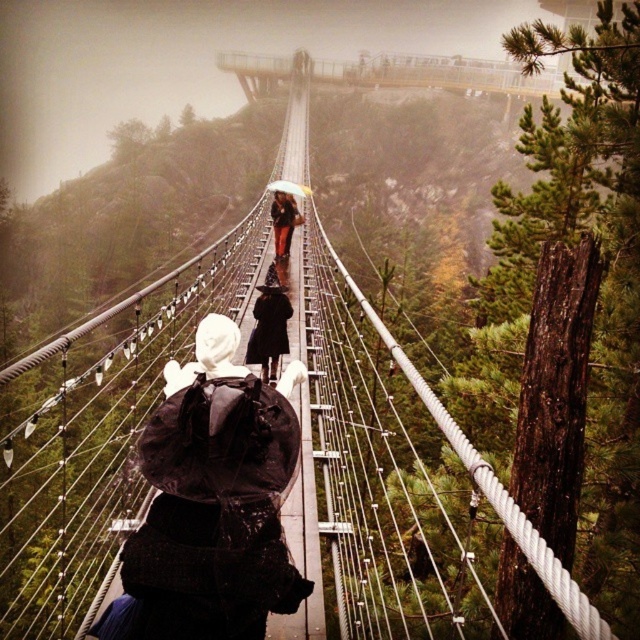
Can you confirm if black matte coat at center is smaller than dark brown leather jacket at center?

Indeed, black matte coat at center has a smaller size compared to dark brown leather jacket at center.

Which is behind, point (257, 362) or point (275, 195)?

The point (275, 195) is behind.

Does point (273, 305) come behind point (285, 205)?

No, it is not.

Image resolution: width=640 pixels, height=640 pixels. What are the coordinates of `black matte coat at center` in the screenshot? It's located at (268, 330).

Does dark brown leather jacket at center appear on the right side of white matte umbrella at center?

Yes, dark brown leather jacket at center is to the right of white matte umbrella at center.

The image size is (640, 640). What do you see at coordinates (284, 221) in the screenshot? I see `dark brown leather jacket at center` at bounding box center [284, 221].

Which is behind, point (278, 216) or point (275, 189)?

Positioned behind is point (275, 189).

I want to click on dark brown leather jacket at center, so click(x=284, y=221).

In order to click on metallic gray bridge at upper center in this screenshot , I will do `click(388, 74)`.

At what (x,y) coordinates should I click in order to perform the action: click on metallic gray bridge at upper center. Please return your answer as a coordinate pair (x, y). Image resolution: width=640 pixels, height=640 pixels. Looking at the image, I should click on (388, 74).

Identify the location of metallic gray bridge at upper center. (388, 74).